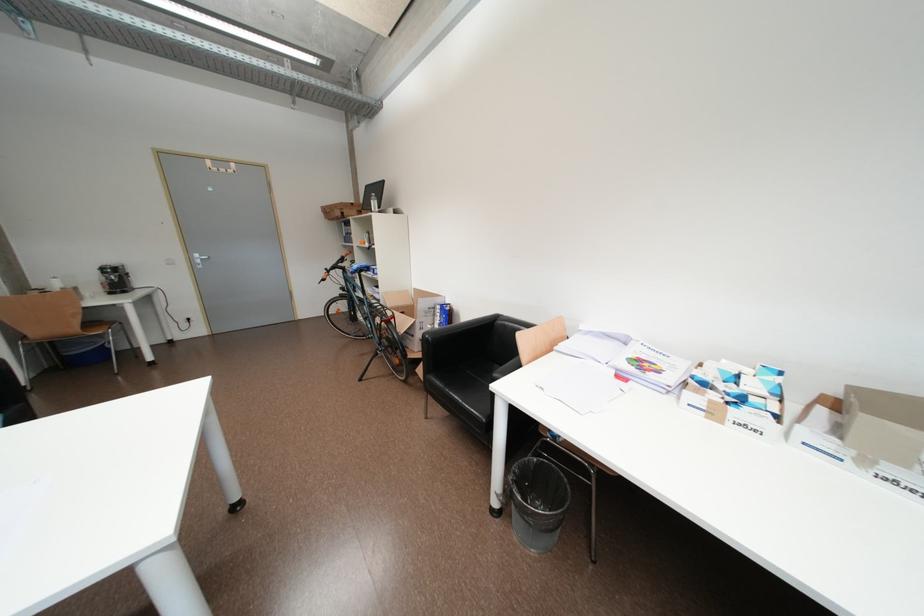
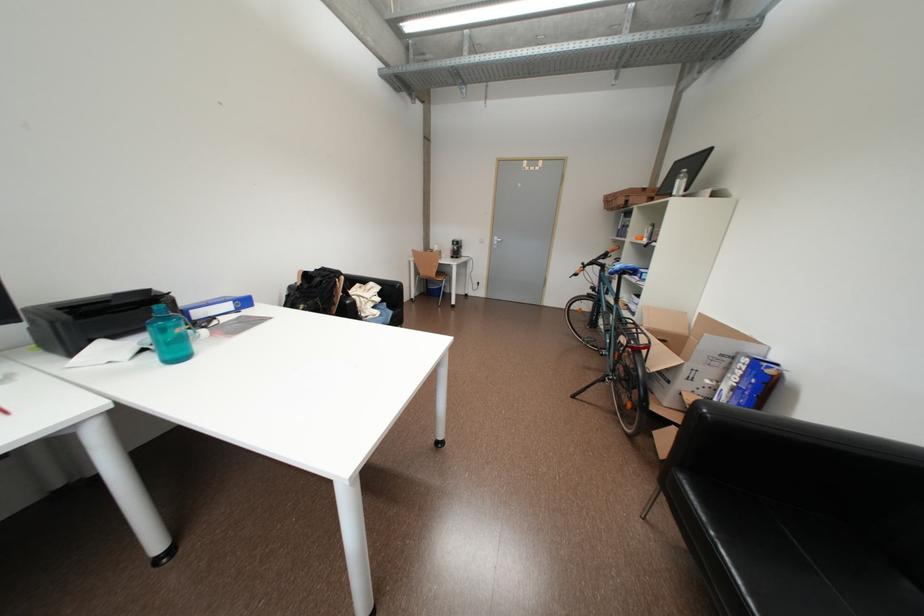
Locate, in the second image, the point that corresponds to [438,310] in the first image.

(731, 358)